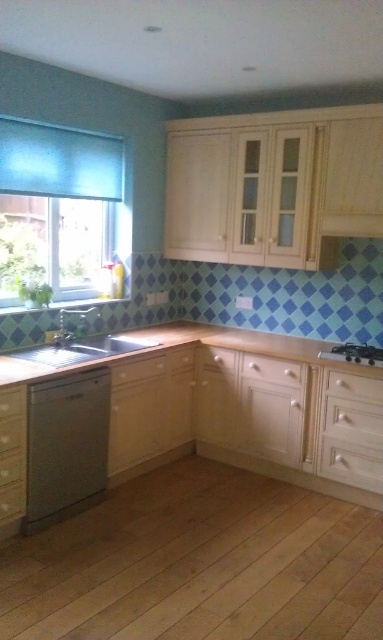
Question: Is matte white drawer at lower left closer to the viewer compared to matte wood drawer at center?

Choices:
 (A) yes
 (B) no

Answer: (A)

Question: Which of the following is the farthest from the observer?

Choices:
 (A) (240, 365)
 (B) (16, 419)
 (C) (73, 339)

Answer: (A)

Question: In this image, where is satin silver sink at lower left located relative to white wood drawer at center?

Choices:
 (A) right
 (B) left

Answer: (B)

Question: Can you confirm if matte white drawer at lower left is positioned above matte wood drawer at center?

Choices:
 (A) no
 (B) yes

Answer: (A)

Question: Which point is closer to the camera taking this photo?

Choices:
 (A) (60, 250)
 (B) (253, 369)

Answer: (B)

Question: Which of these objects is positioned closest to the satin silver dishwasher at lower left?

Choices:
 (A) matte white drawer at lower left
 (B) black matte stove at lower right
 (C) wooden countertop at lower center
 (D) translucent plastic window at left

Answer: (A)